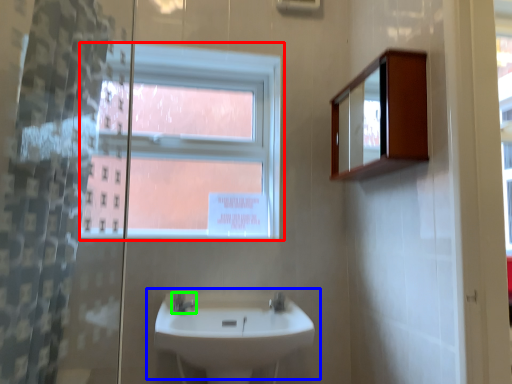
Question: Estimate the real-world distances between objects in this image. Which object is farther from window (highlighted by a red box), sink (highlighted by a blue box) or tap (highlighted by a green box)?

Choices:
 (A) sink
 (B) tap

Answer: (B)